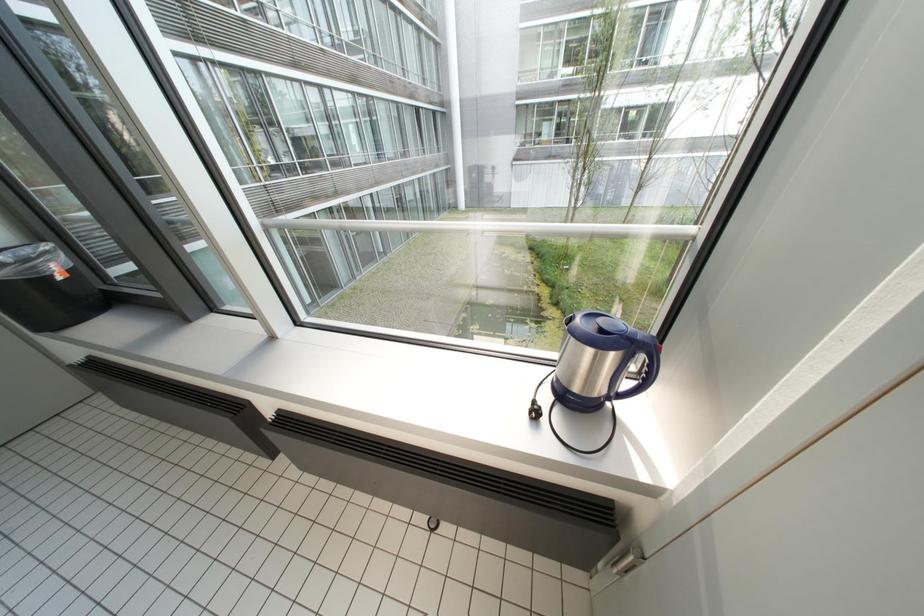
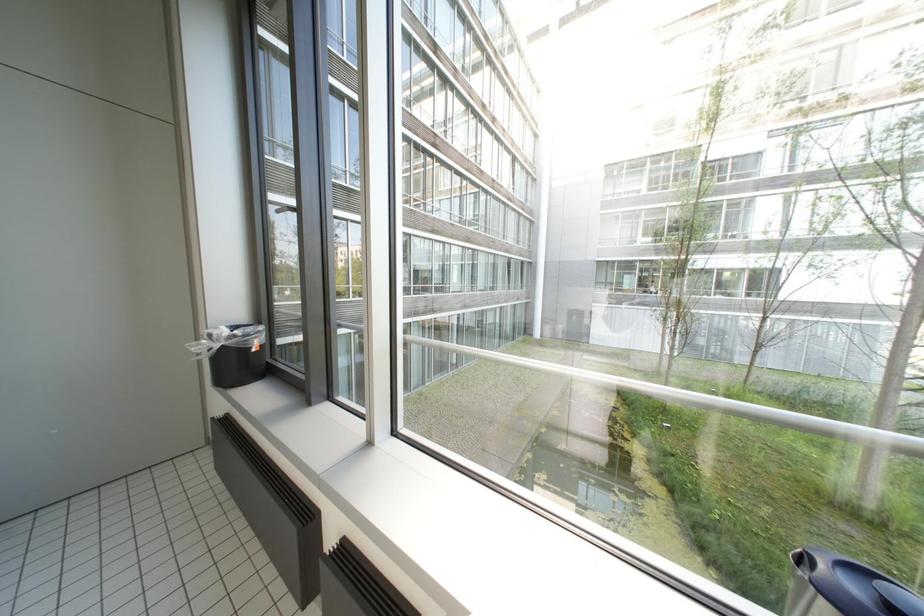
Based on the continuous images, in which direction is the camera rotating?

The camera's rotation is toward left-up.